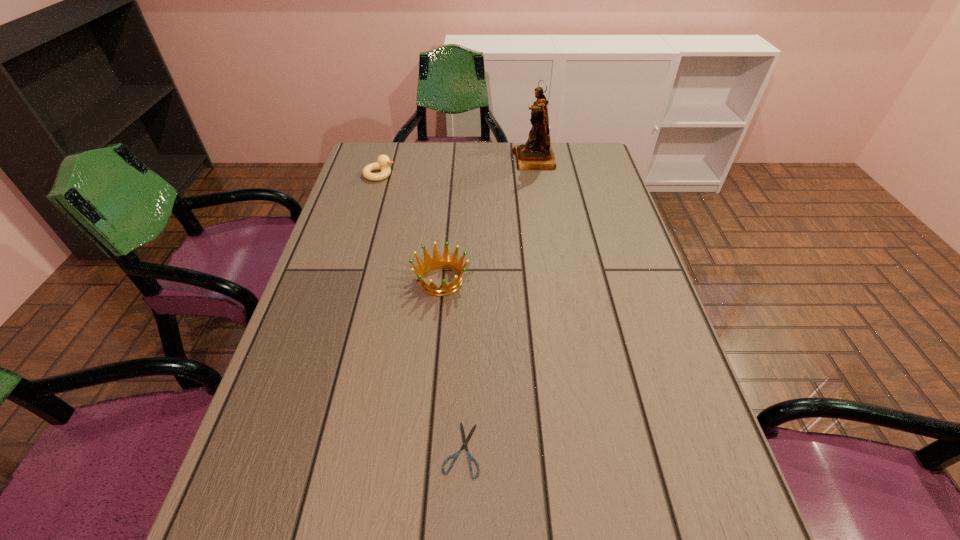
In the image, there is a desktop. Identify the location of free space at the right edge. (634, 280).

Locate an element on the screen. blank area at the far right corner is located at coordinates (597, 154).

Locate an element on the screen. vacant area that lies between the duckling and the rightmost object is located at coordinates (457, 167).

This screenshot has height=540, width=960. What are the coordinates of `empty location between the crown and the duckling` in the screenshot? It's located at (410, 228).

The width and height of the screenshot is (960, 540). Identify the location of vacant space that's between the rightmost object and the crown. (488, 220).

In order to click on unoccupied position between the shortest object and the crown in this screenshot , I will do `click(451, 365)`.

You are a GUI agent. You are given a task and a screenshot of the screen. Output one action in this format:
    pyautogui.click(x=<x>, y=<y>)
    Task: Click on the unoccupied area between the figurine and the leftmost object
    
    Given the screenshot: What is the action you would take?
    pyautogui.click(x=457, y=167)

I want to click on blank region between the leftmost object and the third farthest object, so click(410, 228).

Where is `vacant space in between the tallest object and the second nearest object`? vacant space in between the tallest object and the second nearest object is located at coordinates (488, 220).

At what (x,y) coordinates should I click in order to perform the action: click on free spot between the leftmost object and the shortest object. Please return your answer as a coordinate pair (x, y). The width and height of the screenshot is (960, 540). Looking at the image, I should click on (420, 312).